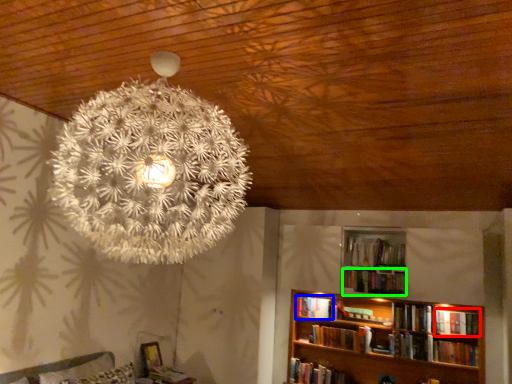
Question: Considering the real-world distances, which object is farthest from book (highlighted by a red box)? book (highlighted by a blue box) or book (highlighted by a green box)?

Choices:
 (A) book
 (B) book

Answer: (A)